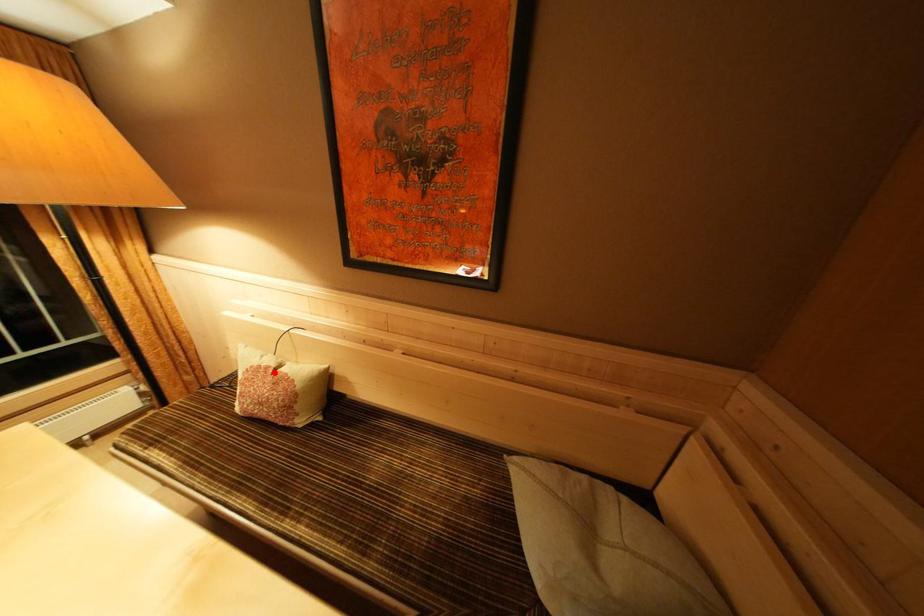
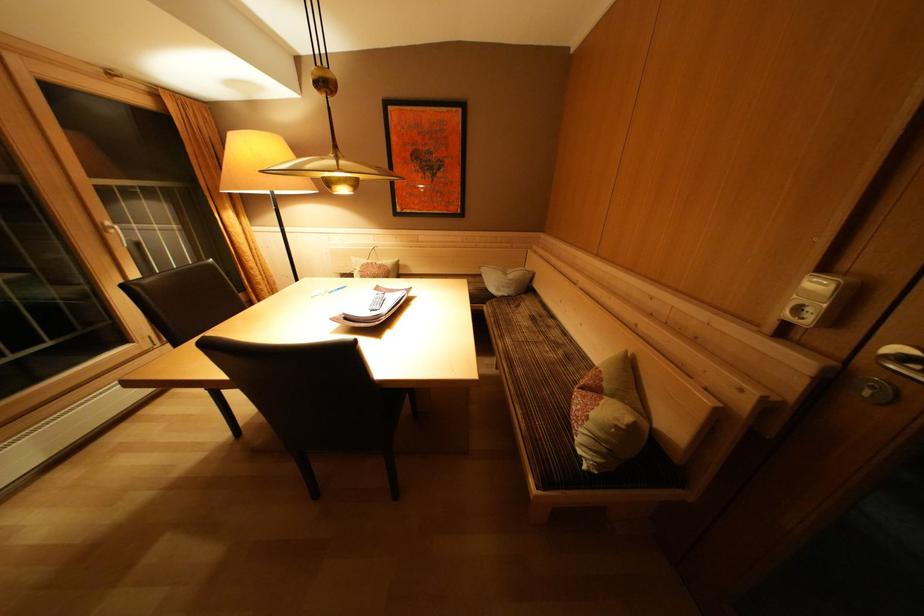
Question: A red point is marked in image1. In image2, is the corresponding 3D point closer to the camera or farther? Reply with the corresponding letter.

Choices:
 (A) The corresponding 3D point is closer.
 (B) The corresponding 3D point is farther.

Answer: (A)